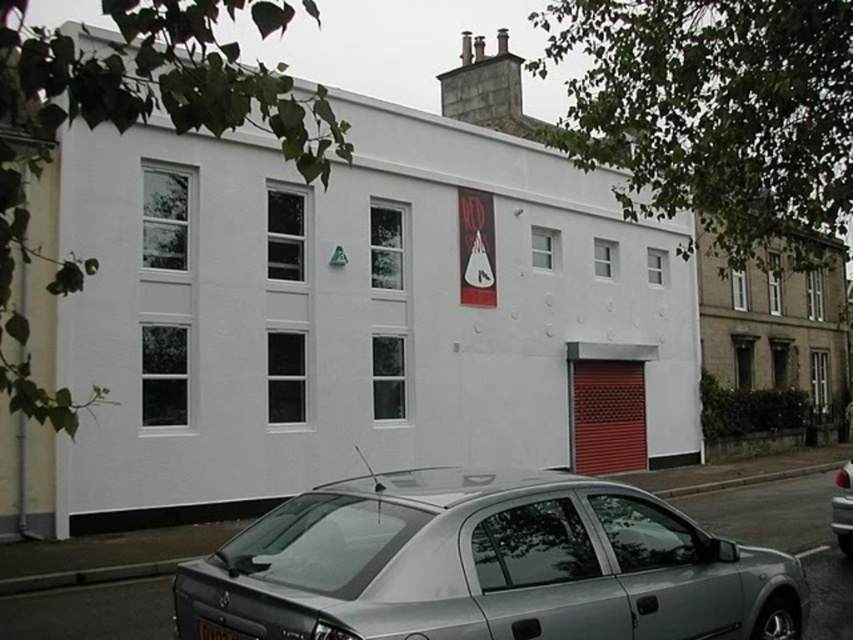
Consider the image. Can you confirm if silver metallic car at lower right is positioned below black plastic license plate at lower center?

Indeed, silver metallic car at lower right is positioned under black plastic license plate at lower center.

Can you confirm if silver metallic car at lower right is bigger than black plastic license plate at lower center?

Correct, silver metallic car at lower right is larger in size than black plastic license plate at lower center.

The image size is (853, 640). Describe the element at coordinates (842, 508) in the screenshot. I see `silver metallic car at lower right` at that location.

Identify the location of silver metallic car at lower right. (842, 508).

Measure the distance between satin silver sedan at lower center and silver metallic car at lower right.

A distance of 21.55 feet exists between satin silver sedan at lower center and silver metallic car at lower right.

Does satin silver sedan at lower center have a greater height compared to silver metallic car at lower right?

No, satin silver sedan at lower center is not taller than silver metallic car at lower right.

Is point (648, 602) behind point (851, 518)?

No, it is not.

This screenshot has width=853, height=640. Identify the location of satin silver sedan at lower center. tap(488, 564).

Is satin silver sedan at lower center shorter than black plastic license plate at lower center?

No.

The width and height of the screenshot is (853, 640). What are the coordinates of `satin silver sedan at lower center` in the screenshot? It's located at (488, 564).